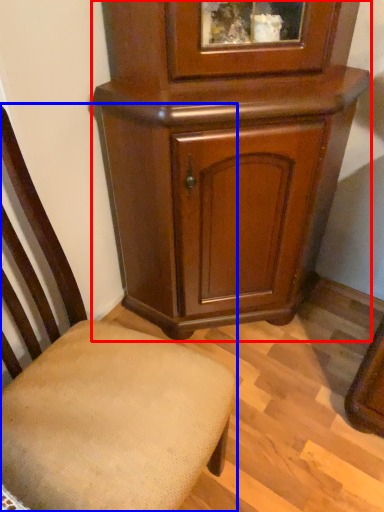
Question: Which object appears closest to the camera in this image, cupboard (highlighted by a red box) or chair (highlighted by a blue box)?

Choices:
 (A) cupboard
 (B) chair

Answer: (B)